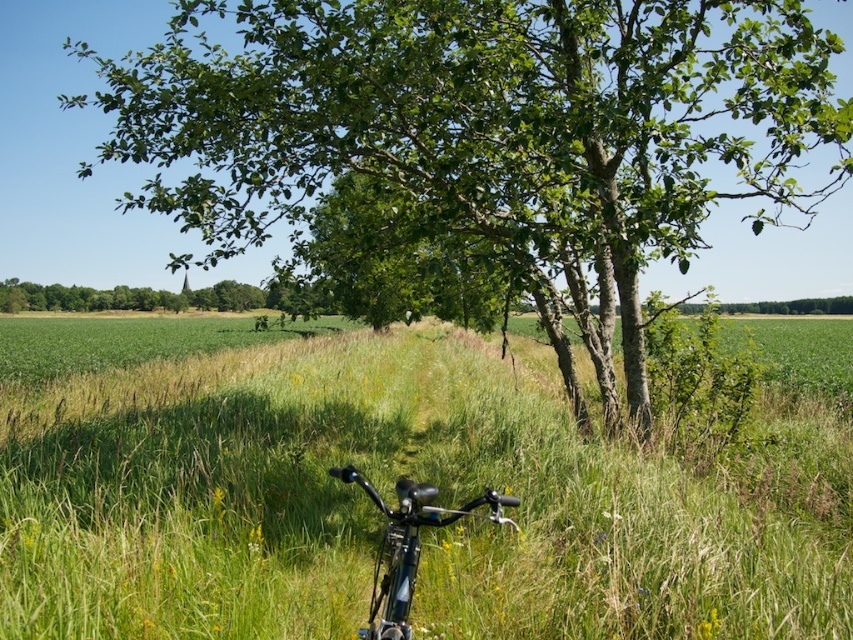
Question: Is green leafy tree at center bigger than shiny metallic bicycle at lower center?

Choices:
 (A) yes
 (B) no

Answer: (A)

Question: Where is green grassy at lower center located in relation to green leafy tree at center in the image?

Choices:
 (A) below
 (B) above

Answer: (A)

Question: Can you confirm if green grassy at lower center is bigger than shiny metallic bicycle at lower center?

Choices:
 (A) no
 (B) yes

Answer: (B)

Question: Which point is closer to the camera taking this photo?

Choices:
 (A) (421, 497)
 (B) (62, 339)
 (C) (645, 168)

Answer: (A)

Question: Among these points, which one is farthest from the camera?

Choices:
 (A) (614, 536)
 (B) (769, 154)

Answer: (B)

Question: Which point is farther from the camera taking this photo?

Choices:
 (A) (532, 48)
 (B) (384, 634)

Answer: (A)